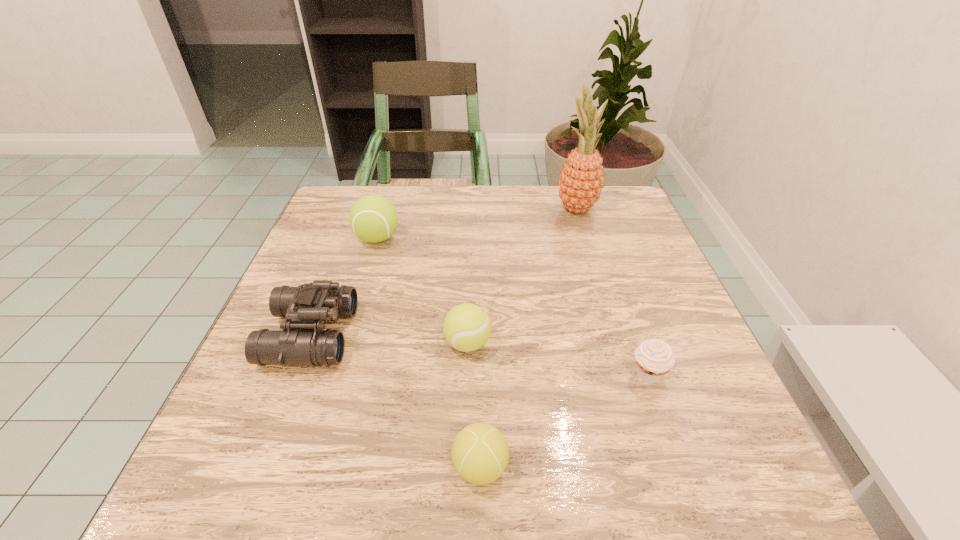
Identify the location of the closest object to the second farthest tennis ball. The image size is (960, 540). (480, 453).

Locate which tennis ball is the closest to the farthest tennis ball. Please provide its 2D coordinates. Your answer should be formatted as a tuple, i.e. [(x, y)], where the tuple contains the x and y coordinates of a point satisfying the conditions above.

[(467, 327)]

Point out which tennis ball is positioned as the second nearest to the nearest tennis ball. Please provide its 2D coordinates. Your answer should be formatted as a tuple, i.e. [(x, y)], where the tuple contains the x and y coordinates of a point satisfying the conditions above.

[(373, 218)]

The image size is (960, 540). Identify the location of vacant space that satisfies the following two spatial constraints: 1. on the back side of the farthest tennis ball; 2. on the right side of the pineapple. (386, 208).

At what (x,y) coordinates should I click in order to perform the action: click on free point that satisfies the following two spatial constraints: 1. on the back side of the second nearest tennis ball; 2. through the lenses of the binoculars. Please return your answer as a coordinate pair (x, y). This screenshot has height=540, width=960. Looking at the image, I should click on (468, 335).

What are the coordinates of `vacant region that satisfies the following two spatial constraints: 1. through the lenses of the nearest tennis ball; 2. on the left side of the binoculars` in the screenshot? It's located at (260, 467).

The width and height of the screenshot is (960, 540). Identify the location of free spot that satisfies the following two spatial constraints: 1. through the lenses of the binoculars; 2. on the right side of the second farthest tennis ball. (307, 343).

Image resolution: width=960 pixels, height=540 pixels. I want to click on free spot that satisfies the following two spatial constraints: 1. on the front side of the farthest object; 2. through the lenses of the binoculars, so click(615, 335).

Identify the location of free spot that satisfies the following two spatial constraints: 1. on the front side of the tallest tennis ball; 2. on the right side of the second nearest tennis ball. The height and width of the screenshot is (540, 960). (347, 343).

Where is `vacant region that satisfies the following two spatial constraints: 1. through the lenses of the binoculars; 2. on the left side of the muffin`? Image resolution: width=960 pixels, height=540 pixels. vacant region that satisfies the following two spatial constraints: 1. through the lenses of the binoculars; 2. on the left side of the muffin is located at coordinates (295, 375).